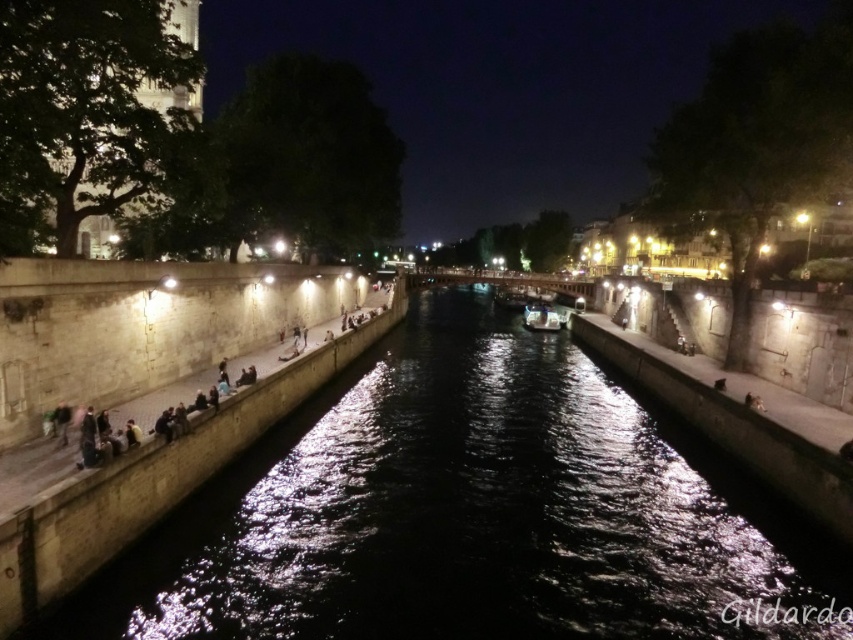
Question: Is smooth stone tower at upper left above shiny silver boat at center?

Choices:
 (A) yes
 (B) no

Answer: (A)

Question: Which of the following is the closest to the observer?

Choices:
 (A) smooth stone tower at upper left
 (B) shiny silver boat at center

Answer: (A)

Question: Does smooth stone tower at upper left have a greater width compared to shiny silver boat at center?

Choices:
 (A) no
 (B) yes

Answer: (B)

Question: Does smooth stone tower at upper left have a smaller size compared to shiny silver boat at center?

Choices:
 (A) yes
 (B) no

Answer: (B)

Question: Which point appears farthest from the camera in this image?

Choices:
 (A) (544, 316)
 (B) (100, 141)

Answer: (A)